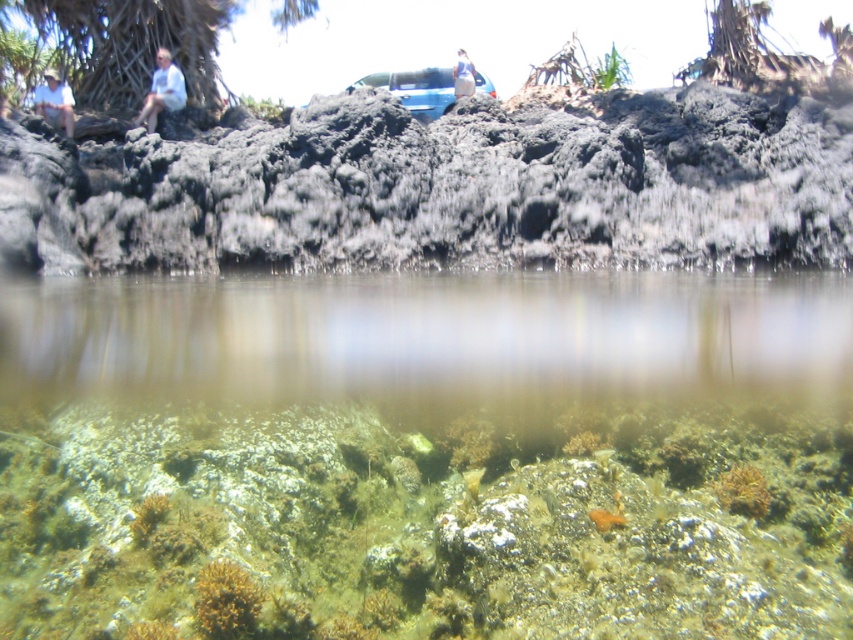
Question: Does orange coral at lower center lie behind white shirt at upper left?

Choices:
 (A) no
 (B) yes

Answer: (A)

Question: Does orange coral at lower center have a lesser width compared to orange matte fish at lower center?

Choices:
 (A) yes
 (B) no

Answer: (B)

Question: Is white shirt at upper left thinner than orange matte fish at lower center?

Choices:
 (A) yes
 (B) no

Answer: (B)

Question: Which point appears farthest from the camera in this image?

Choices:
 (A) (51, 116)
 (B) (47, 497)
 (C) (759, 486)

Answer: (A)

Question: Which point is closer to the camera?

Choices:
 (A) light blue shirt at upper left
 (B) orange matte fish at lower center
 (C) orange coral at lower center

Answer: (B)

Question: Which point is closer to the camera?

Choices:
 (A) (325, 426)
 (B) (467, 56)
 (C) (196, 595)
 (D) (735, 404)

Answer: (C)